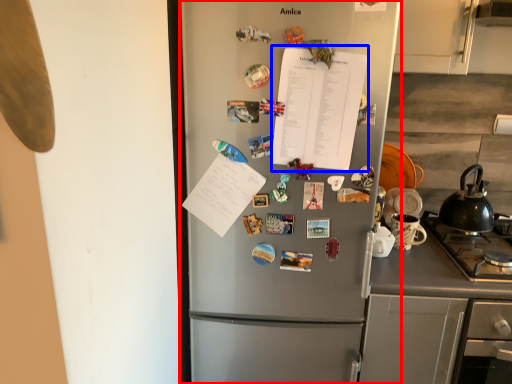
Question: Among these objects, which one is farthest to the camera, refrigerator (highlighted by a red box) or notebook (highlighted by a blue box)?

Choices:
 (A) refrigerator
 (B) notebook

Answer: (B)